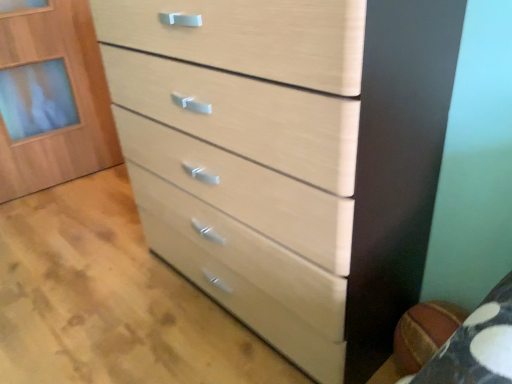
Find the location of a particular element. blank space situated above light wood drawer at center (from a real-world perspective) is located at coordinates (99, 270).